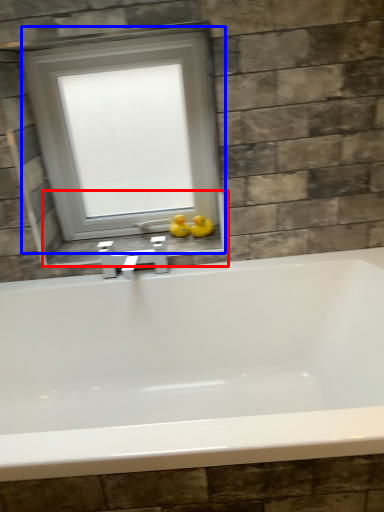
Question: Among these objects, which one is farthest to the camera, window sill (highlighted by a red box) or window (highlighted by a blue box)?

Choices:
 (A) window sill
 (B) window

Answer: (A)